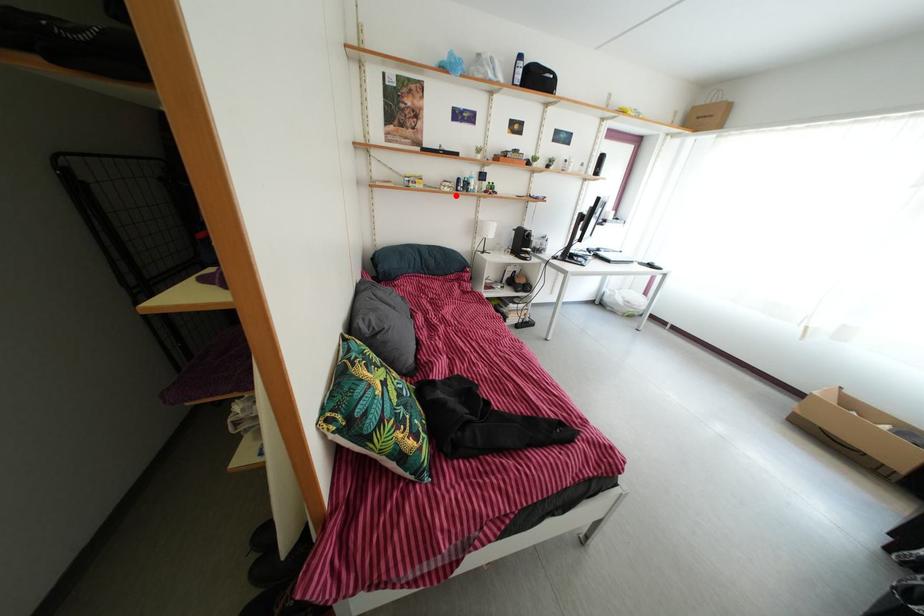
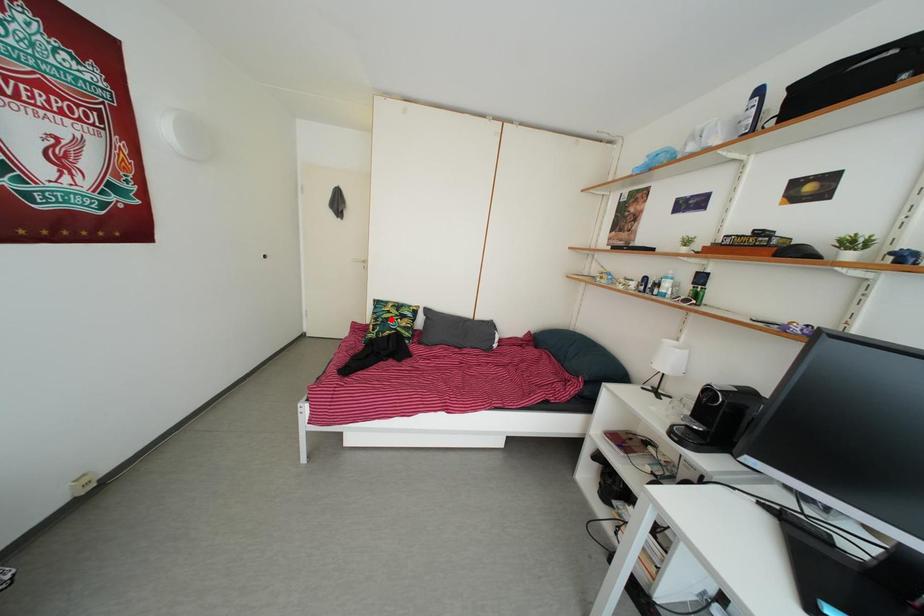
I am providing you with two images of the same scene from different viewpoints. A red point is marked on the first image and another point is marked on the second image. Do the highlighted points in image1 and image2 indicate the same real-world spot?

No